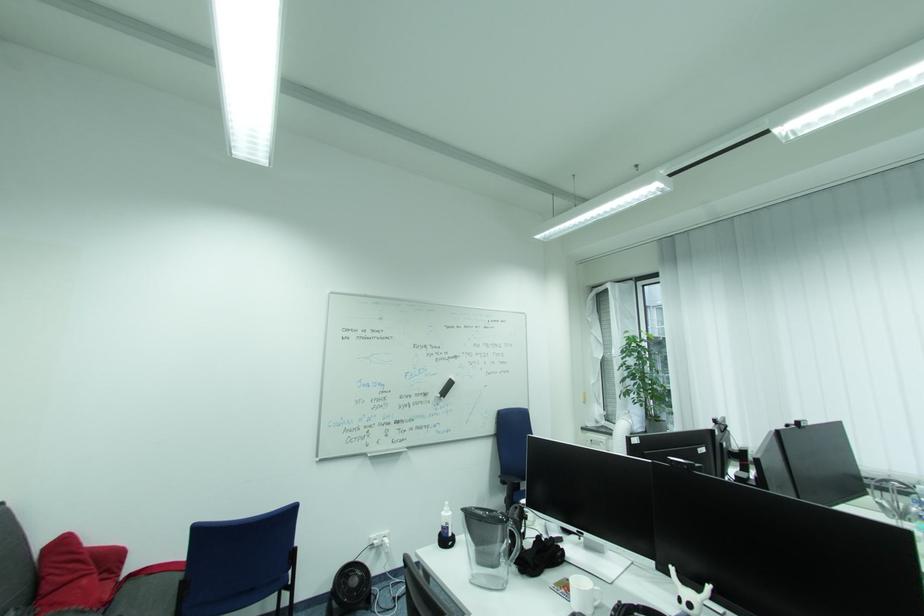
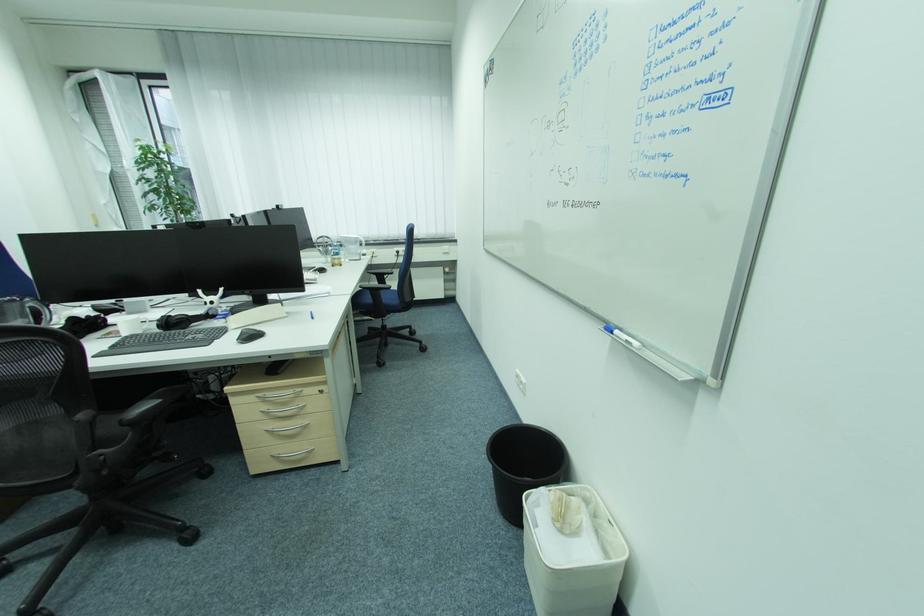
First-person continuous shooting, in which direction is the camera rotating?

The camera rotated toward right-down.